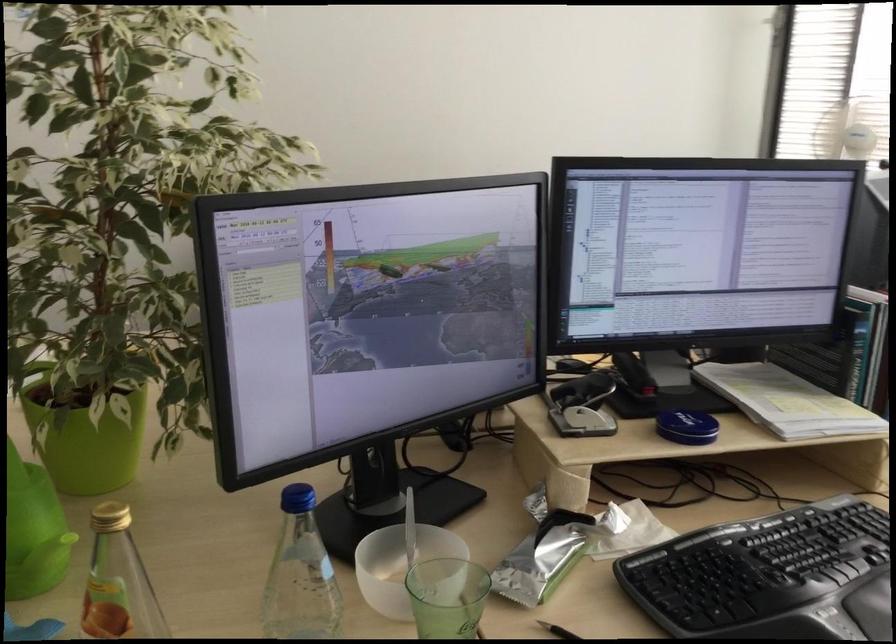
This screenshot has height=644, width=896. Identify the location of black pen. (557, 630).